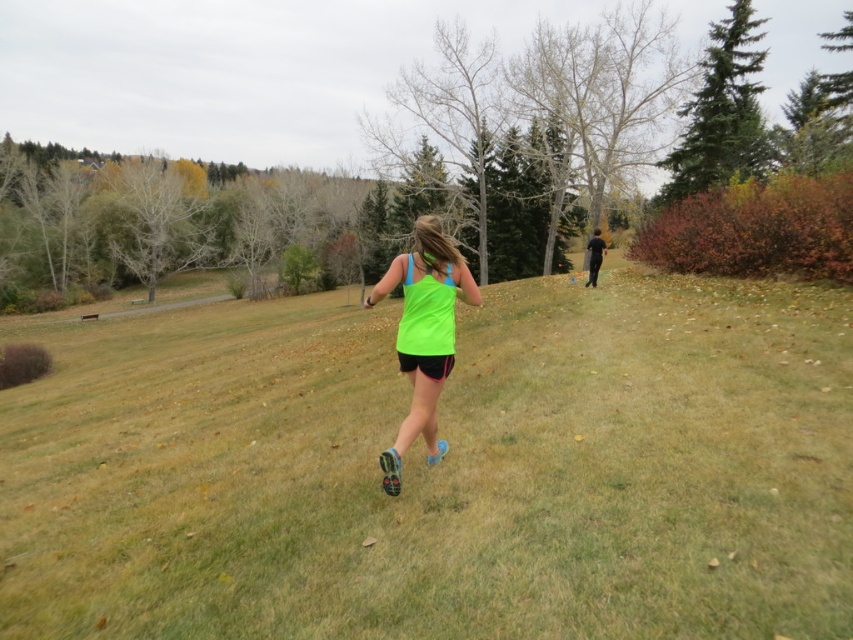
Question: In this image, where is green grass at center located relative to neon green fabric tank top at center?

Choices:
 (A) below
 (B) above

Answer: (A)

Question: Does green grass at center have a lesser width compared to neon green fabric tank top at center?

Choices:
 (A) yes
 (B) no

Answer: (B)

Question: Which object appears closest to the camera in this image?

Choices:
 (A) green grass at center
 (B) neon green fabric tank top at center

Answer: (A)

Question: Which point is farther from the camera taking this photo?

Choices:
 (A) (677, 392)
 (B) (395, 458)

Answer: (A)

Question: Can you confirm if green grass at center is positioned below neon green fabric tank top at center?

Choices:
 (A) yes
 (B) no

Answer: (A)

Question: Which object appears closest to the camera in this image?

Choices:
 (A) green grass at center
 (B) neon green fabric tank top at center

Answer: (A)